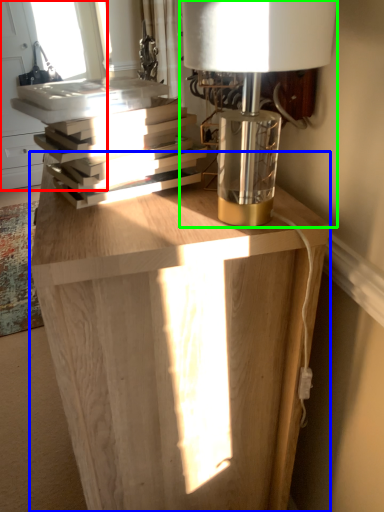
Question: Estimate the real-world distances between objects in this image. Which object is closer to window (highlighted by a red box), table (highlighted by a blue box) or lamp (highlighted by a green box)?

Choices:
 (A) table
 (B) lamp

Answer: (B)